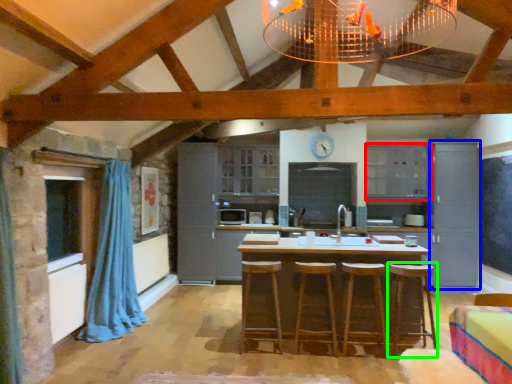
Question: Which object is the closest to the cabinetry (highlighted by a red box)? Choose among these: cabinetry (highlighted by a blue box) or bar stool (highlighted by a green box).

Choices:
 (A) cabinetry
 (B) bar stool

Answer: (A)